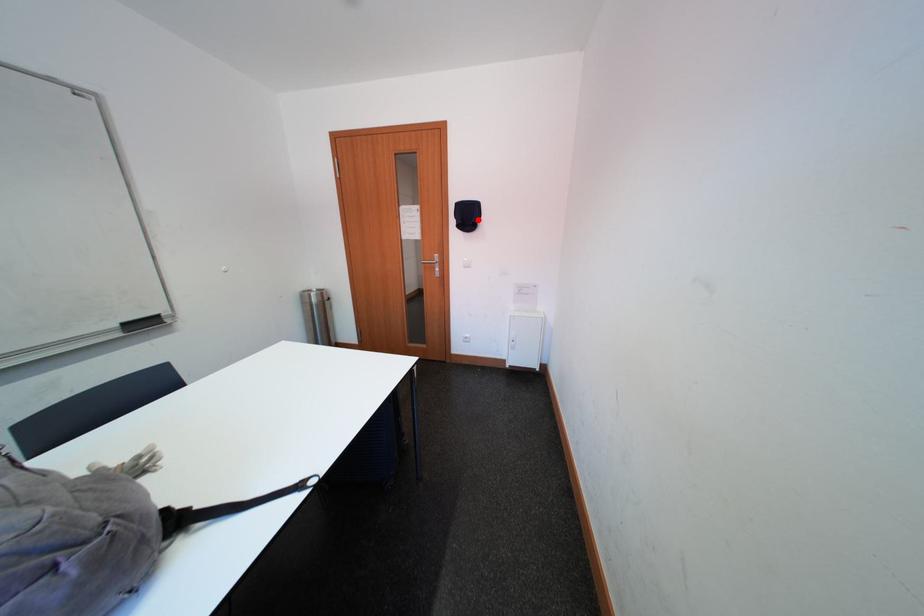
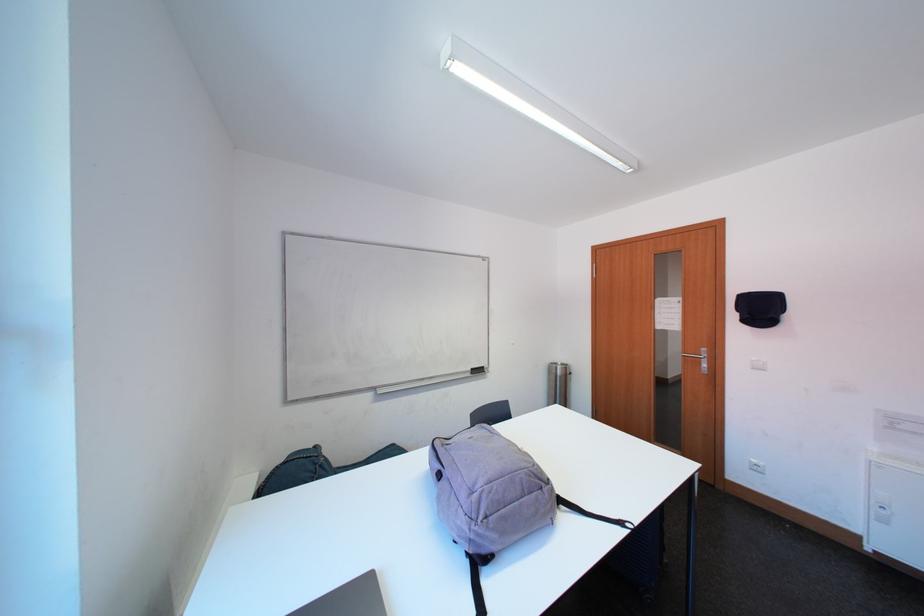
Where in the second image is the point corresponding to the highlighted location from the first image?

(771, 313)